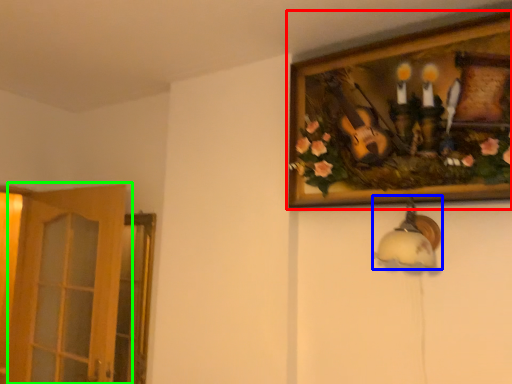
Question: Which is farther away from picture frame (highlighted by a red box)? lamp (highlighted by a blue box) or door (highlighted by a green box)?

Choices:
 (A) lamp
 (B) door

Answer: (B)